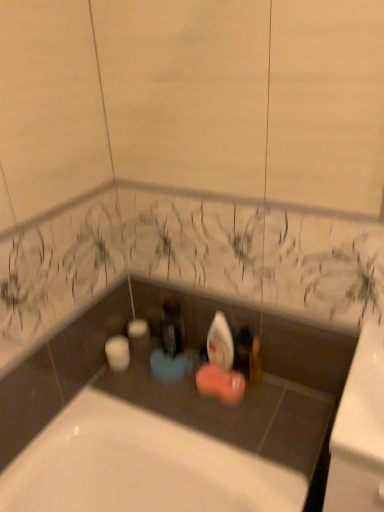
Question: Should I look upward or downward to see matte gold soap at center?

Choices:
 (A) down
 (B) up

Answer: (A)

Question: Is matte gold soap at center to the left of matte black bottle at center from the viewer's perspective?

Choices:
 (A) no
 (B) yes

Answer: (A)

Question: Can you confirm if matte gold soap at center is wider than matte black bottle at center?

Choices:
 (A) no
 (B) yes

Answer: (B)

Question: From the image's perspective, would you say matte gold soap at center is shown under matte black bottle at center?

Choices:
 (A) yes
 (B) no

Answer: (A)

Question: Is matte gold soap at center not near matte black bottle at center?

Choices:
 (A) no
 (B) yes

Answer: (A)

Question: From a real-world perspective, is matte gold soap at center over matte black bottle at center?

Choices:
 (A) no
 (B) yes

Answer: (A)

Question: Is the position of matte gold soap at center less distant than that of matte black bottle at center?

Choices:
 (A) no
 (B) yes

Answer: (B)

Question: Considering the relative positions of matte black bottle at center and matte gold soap at center in the image provided, is matte black bottle at center in front of matte gold soap at center?

Choices:
 (A) yes
 (B) no

Answer: (B)

Question: Is matte black bottle at center at the left side of matte gold soap at center?

Choices:
 (A) no
 (B) yes

Answer: (B)

Question: Does matte black bottle at center touch matte gold soap at center?

Choices:
 (A) no
 (B) yes

Answer: (A)

Question: From the image's perspective, is matte black bottle at center located beneath matte gold soap at center?

Choices:
 (A) no
 (B) yes

Answer: (A)

Question: Considering the relative sizes of matte black bottle at center and matte gold soap at center in the image provided, is matte black bottle at center thinner than matte gold soap at center?

Choices:
 (A) yes
 (B) no

Answer: (A)

Question: From a real-world perspective, is matte black bottle at center positioned over matte gold soap at center based on gravity?

Choices:
 (A) no
 (B) yes

Answer: (B)

Question: Is matte gold soap at center inside the boundaries of matte black bottle at center, or outside?

Choices:
 (A) inside
 (B) outside

Answer: (B)